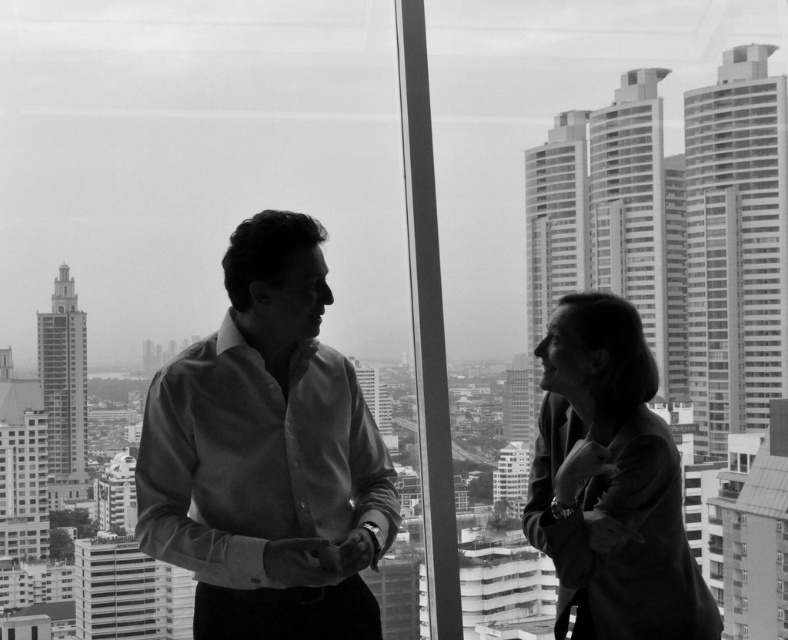
You are a tailor who needs to determine which garment requires more fabric between the smooth shirt at center and the smooth black blazer at right. Based on their sizes, which one would need more fabric?

→ The smooth shirt at center is larger in size than the smooth black blazer at right, so it would require more fabric.

From the picture: You are an interior designer working on a layout for a meeting room. You need to place a large conference table between the matte white shirt at center and the smooth black blazer at right. Based on their positions in the image, which side of the table should each person stand on?

The matte white shirt at center should stand on the left side of the table, and the smooth black blazer at right should stand on the right side, as the matte white shirt at center is positioned on the left side of the smooth black blazer at right in the image.

You are an interior designer assessing the layout of a meeting room. You notice the smooth shirt at center and the smooth black blazer at right. Which object is positioned lower in the room?

The smooth shirt at center is located below the smooth black blazer at right, so it is positioned lower in the room.